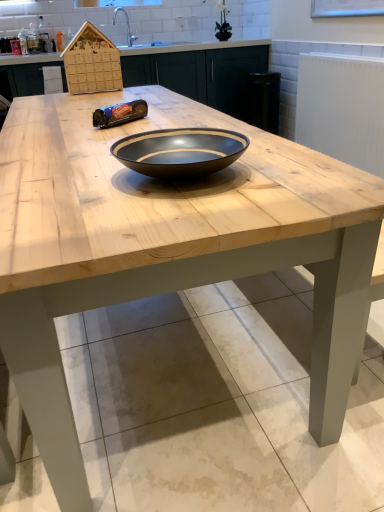
What are the coordinates of `empty space that is to the right of black glossy bowl at center` in the screenshot? It's located at (300, 167).